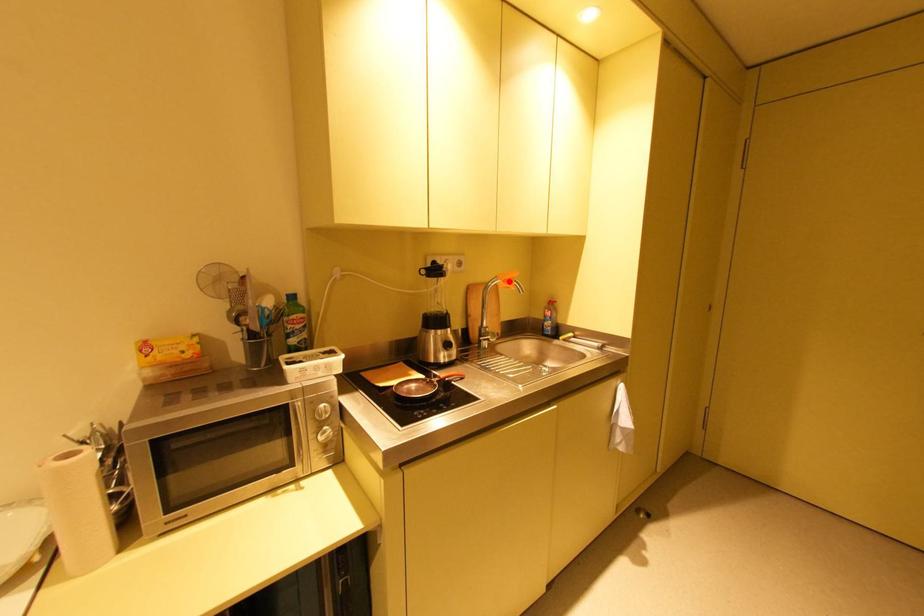
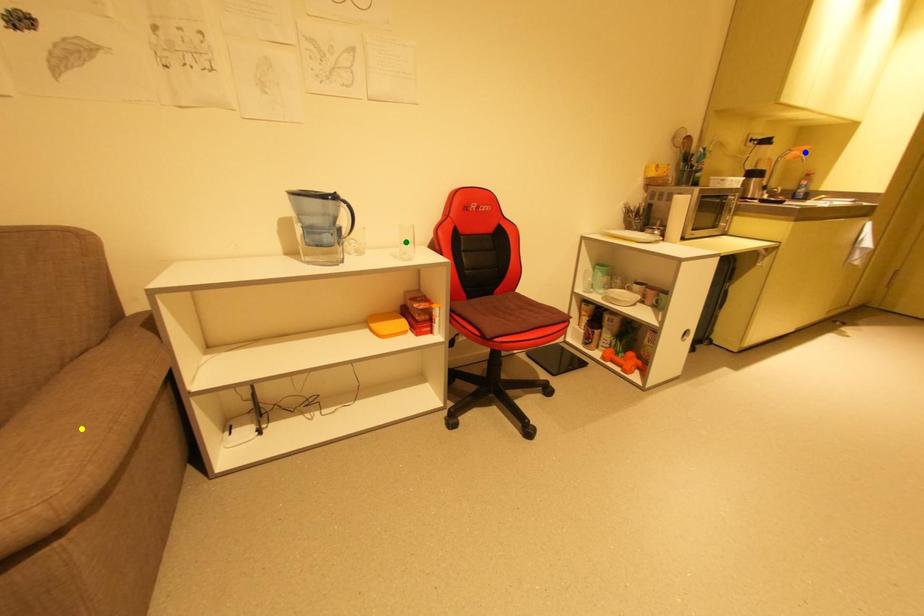
Question: I am providing you with two images of the same scene from different viewpoints. A red point is marked on the first image. You are given multiple points on the second image. Can you choose the point in image 2 that corresponds to the point in image 1?

Choices:
 (A) yellow point
 (B) blue point
 (C) green point

Answer: (B)